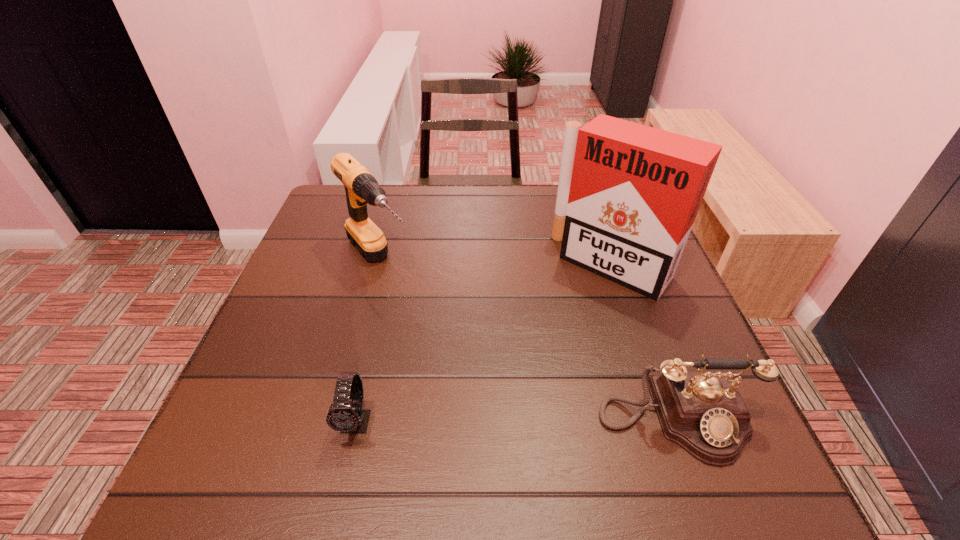
Identify the location of free space on the desktop that is between the shortest object and the telephone and is positioned on the front-facing side of the tallest object. (478, 421).

Identify the location of free space on the desktop that is between the shortest object and the third tallest object and is positioned at the tip of the third shortest object. (519, 421).